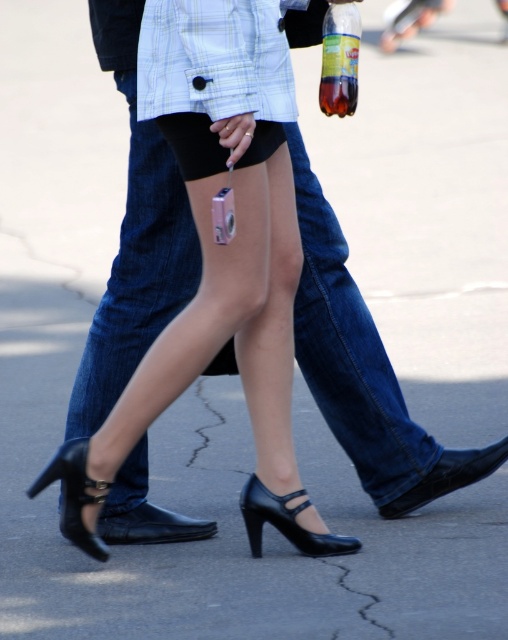
Between black leather heel at lower left and black patent leather heel at lower center, which one is positioned lower?

black patent leather heel at lower center

Who is more forward, (33, 488) or (259, 541)?

Point (33, 488)

In the scene shown: Who is more forward, (33, 492) or (282, 500)?

Point (33, 492)

Locate an element on the screen. The width and height of the screenshot is (508, 640). black leather heel at lower left is located at coordinates [75, 496].

Which is above, black leather heel at lower left or translucent plastic bottle at center?

translucent plastic bottle at center

From the picture: Who is more distant from viewer, (76, 538) or (339, 113)?

Point (339, 113)

The image size is (508, 640). In order to click on black leather heel at lower left in this screenshot , I will do pos(75,496).

Locate an element on the screen. black leather heel at lower left is located at coordinates (75, 496).

Is the position of black patent leather heel at lower center more distant than that of translucent plastic bottle at center?

No.

The height and width of the screenshot is (640, 508). In order to click on black patent leather heel at lower center in this screenshot , I will do `click(287, 522)`.